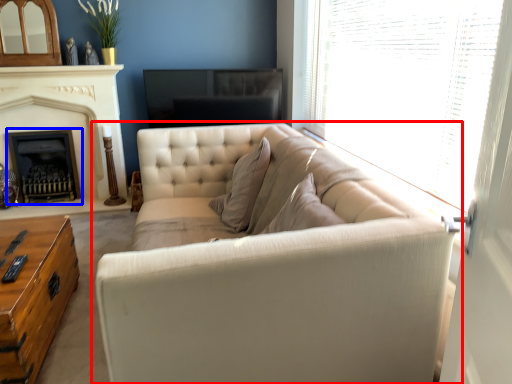
Question: Which object appears farthest to the camera in this image, studio couch (highlighted by a red box) or fireplace (highlighted by a blue box)?

Choices:
 (A) studio couch
 (B) fireplace

Answer: (B)